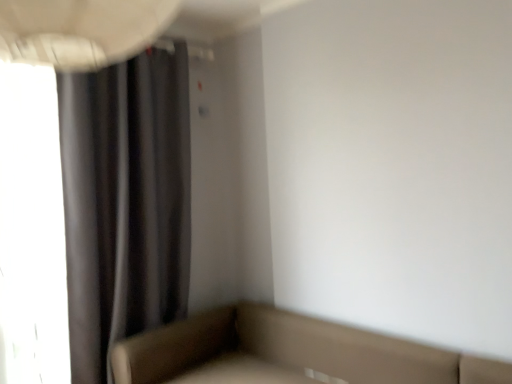
Question: Should I look upward or downward to see leather-like beige studio couch at lower right?

Choices:
 (A) down
 (B) up

Answer: (A)

Question: Can you confirm if dark matte curtain at left is wider than leather-like beige studio couch at lower right?

Choices:
 (A) yes
 (B) no

Answer: (B)

Question: Is dark matte curtain at left completely or partially outside of leather-like beige studio couch at lower right?

Choices:
 (A) no
 (B) yes

Answer: (B)

Question: Is dark matte curtain at left not near leather-like beige studio couch at lower right?

Choices:
 (A) yes
 (B) no

Answer: (B)

Question: From a real-world perspective, is dark matte curtain at left positioned under leather-like beige studio couch at lower right based on gravity?

Choices:
 (A) yes
 (B) no

Answer: (B)

Question: Is leather-like beige studio couch at lower right located within dark matte curtain at left?

Choices:
 (A) no
 (B) yes

Answer: (A)

Question: Is dark matte curtain at left with leather-like beige studio couch at lower right?

Choices:
 (A) yes
 (B) no

Answer: (B)

Question: Is leather-like beige studio couch at lower right positioned behind dark matte curtain at left?

Choices:
 (A) no
 (B) yes

Answer: (A)

Question: Is leather-like beige studio couch at lower right at the right side of dark matte curtain at left?

Choices:
 (A) yes
 (B) no

Answer: (A)

Question: From a real-world perspective, does leather-like beige studio couch at lower right sit lower than dark matte curtain at left?

Choices:
 (A) no
 (B) yes

Answer: (B)

Question: Can you confirm if leather-like beige studio couch at lower right is wider than dark matte curtain at left?

Choices:
 (A) yes
 (B) no

Answer: (A)

Question: Is leather-like beige studio couch at lower right located outside dark matte curtain at left?

Choices:
 (A) yes
 (B) no

Answer: (A)

Question: Does leather-like beige studio couch at lower right have a larger size compared to dark matte curtain at left?

Choices:
 (A) yes
 (B) no

Answer: (A)

Question: Which is correct: dark matte curtain at left is inside leather-like beige studio couch at lower right, or outside of it?

Choices:
 (A) inside
 (B) outside

Answer: (B)